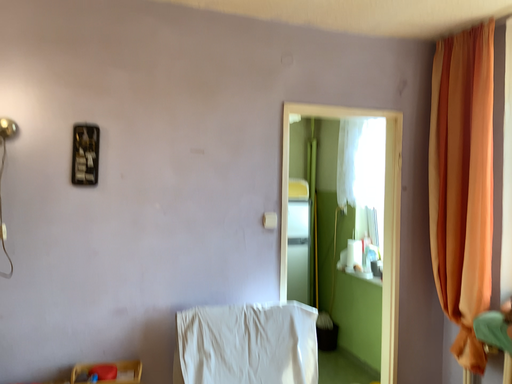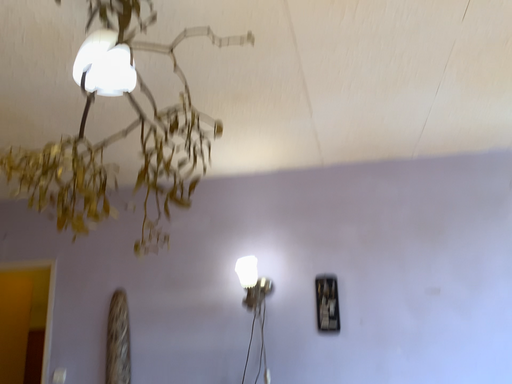
Question: How did the camera likely rotate when shooting the video?

Choices:
 (A) rotated right
 (B) rotated left

Answer: (B)